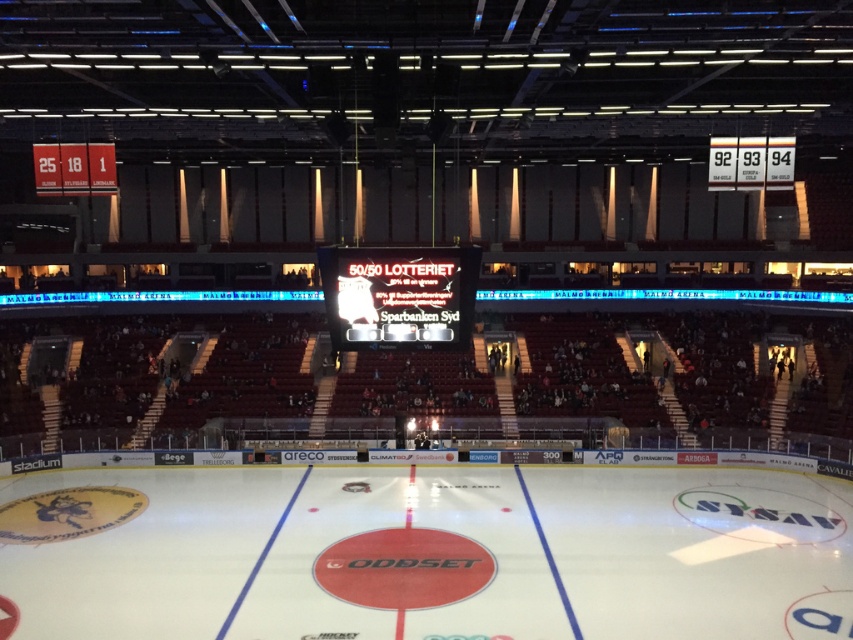
You are a photographer standing at the back of the arena and want to take a photo that includes both the point at point (48, 477) and the point at point (402, 324). Which point will appear closer to the edge of your camera frame?

Point (48, 477) is further to the camera than point (402, 324), so it will appear closer to the edge of your camera frame.

You are an arena manager checking the layout for an upcoming event. You need to place a 10ft wide banner between the white smooth ice at center and the black glossy scoreboard at center. Can you fit it there?

The white smooth ice at center is wider than the black glossy scoreboard at center. Therefore, the 10ft wide banner may not fit between them if the space between is narrower than 10ft. However, the exact dimensions aren

You are a photographer positioned at the back of the arena and want to capture both the white smooth ice at center and the black glossy scoreboard at center in a single shot. Considering their sizes, which object will appear smaller in the photo?

The black glossy scoreboard at center will appear smaller in the photo because the white smooth ice at center is larger in size than the scoreboard, so when captured from the back, the scoreboard would naturally appear smaller relative to the ice.